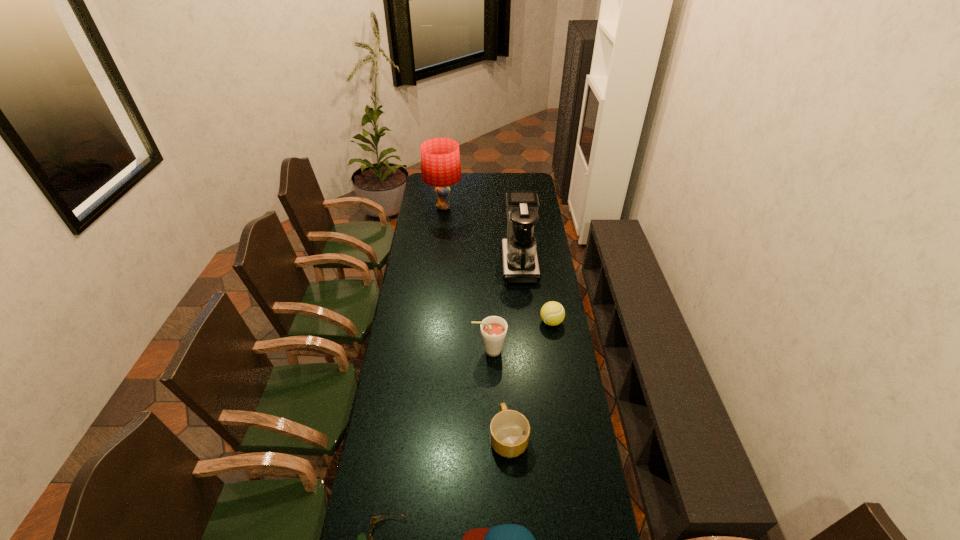
I want to click on lampshade, so click(x=440, y=159).

Where is `the second farthest object`? This screenshot has width=960, height=540. the second farthest object is located at coordinates (519, 255).

The height and width of the screenshot is (540, 960). Identify the location of root beer. (493, 329).

Where is `the third tallest object`? Image resolution: width=960 pixels, height=540 pixels. the third tallest object is located at coordinates (493, 329).

Where is `the third farthest object`? Image resolution: width=960 pixels, height=540 pixels. the third farthest object is located at coordinates (552, 313).

Identify the location of mug. The height and width of the screenshot is (540, 960). (509, 430).

At what (x,y) coordinates should I click in order to perform the action: click on vacant space located on the front-facing side of the lampshade. Please return your answer as a coordinate pair (x, y). Looking at the image, I should click on (483, 207).

You are a GUI agent. You are given a task and a screenshot of the screen. Output one action in this format:
    pyautogui.click(x=<x>, y=<y>)
    Task: Click on the vacant space located at the front of the sixth nearest object where the controls are located
    
    Given the screenshot: What is the action you would take?
    pyautogui.click(x=457, y=264)

Image resolution: width=960 pixels, height=540 pixels. I want to click on vacant space located 0.130m at the front of the sixth nearest object where the controls are located, so click(474, 264).

At what (x,y) coordinates should I click in order to perform the action: click on free space located at the front of the sixth nearest object where the controls are located. Please return your answer as a coordinate pair (x, y). The height and width of the screenshot is (540, 960). Looking at the image, I should click on (468, 264).